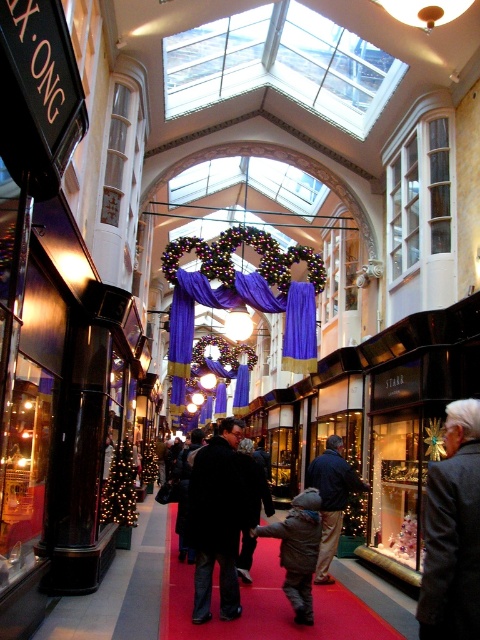
You are a customer in the shopping arcade and want to take a photo of the brown fuzzy coat at center and the purple velvet curtain at center. Which object should you focus on first to ensure both are in the frame?

You should focus on the brown fuzzy coat at center first since it is closer to you than the purple velvet curtain at center, ensuring both are in the frame.

From the picture: You are a store manager organizing the festive shopping arcade. You have two coats displayed at the center of the arcade. The dark gray wool coat at center and the dark wool coat at center. Which coat takes up more space in the display area?

The dark wool coat at center takes up more space than the dark gray wool coat at center, as the dark gray wool coat at center occupies less space than dark wool coat at center.